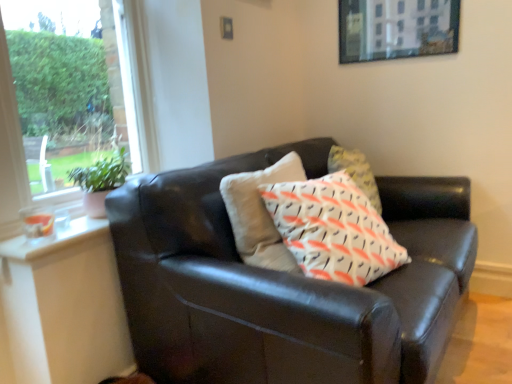
Question: Can you confirm if metallic silver picture frame at upper center is shorter than matte black couch at center?

Choices:
 (A) no
 (B) yes

Answer: (B)

Question: From the image's perspective, is metallic silver picture frame at upper center located beneath matte black couch at center?

Choices:
 (A) yes
 (B) no

Answer: (B)

Question: Considering the relative sizes of metallic silver picture frame at upper center and matte black couch at center in the image provided, is metallic silver picture frame at upper center thinner than matte black couch at center?

Choices:
 (A) yes
 (B) no

Answer: (A)

Question: From a real-world perspective, is metallic silver picture frame at upper center on top of matte black couch at center?

Choices:
 (A) yes
 (B) no

Answer: (A)

Question: Can you confirm if metallic silver picture frame at upper center is positioned to the right of matte black couch at center?

Choices:
 (A) yes
 (B) no

Answer: (A)

Question: Relative to matte black couch at center, is metallic silver picture frame at upper center in front or behind?

Choices:
 (A) front
 (B) behind

Answer: (B)

Question: Based on their sizes in the image, would you say metallic silver picture frame at upper center is bigger or smaller than matte black couch at center?

Choices:
 (A) big
 (B) small

Answer: (B)

Question: Choose the correct answer: Is metallic silver picture frame at upper center inside matte black couch at center or outside it?

Choices:
 (A) inside
 (B) outside

Answer: (B)

Question: From the image's perspective, is metallic silver picture frame at upper center positioned above or below matte black couch at center?

Choices:
 (A) below
 (B) above

Answer: (B)

Question: From a real-world perspective, relative to green leafy plant at left, is matte black couch at center vertically above or below?

Choices:
 (A) above
 (B) below

Answer: (B)

Question: From the image's perspective, is matte black couch at center positioned above or below green leafy plant at left?

Choices:
 (A) above
 (B) below

Answer: (B)

Question: Looking at the image, does matte black couch at center seem bigger or smaller compared to green leafy plant at left?

Choices:
 (A) big
 (B) small

Answer: (A)

Question: Do you think matte black couch at center is within green leafy plant at left, or outside of it?

Choices:
 (A) inside
 (B) outside

Answer: (B)

Question: In terms of width, does matte black couch at center look wider or thinner when compared to clear glass window at upper left?

Choices:
 (A) wide
 (B) thin

Answer: (A)

Question: Is matte black couch at center taller or shorter than clear glass window at upper left?

Choices:
 (A) tall
 (B) short

Answer: (A)